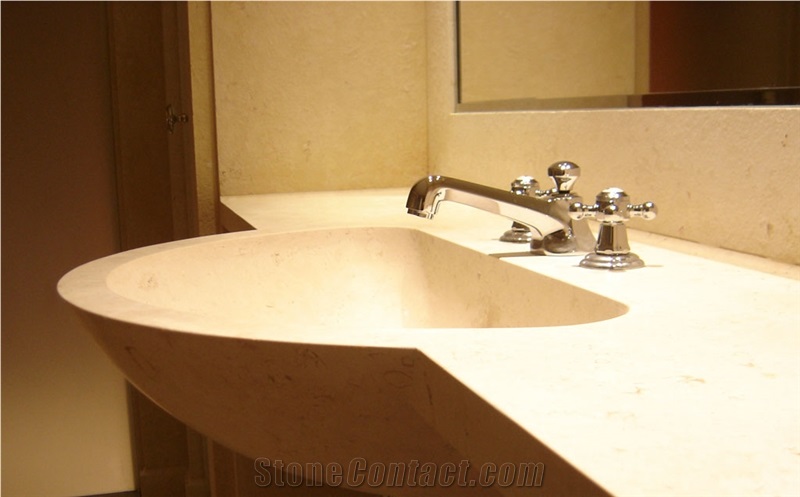
This screenshot has width=800, height=497. What are the coordinates of `door handle` in the screenshot? It's located at pos(174,115).